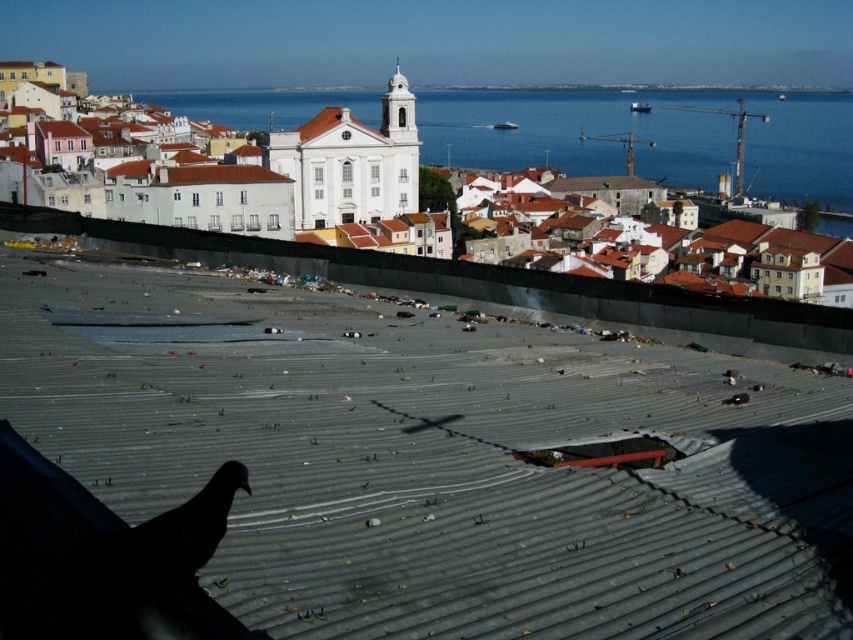
You are a photographer planning to capture the coastal town scene. You notice the black matte bird at lower left and the brown tile roof at center. Which object is closer to the camera in the composition?

The black matte bird at lower left is closer to the camera than the brown tile roof at center because it appears smaller in the image, suggesting it is farther away. However, according to the description, the bird is shorter in real life, so the brown tile roof at center is actually closer.

You are a photographer trying to capture the entire scene of the coastal town. You notice the black matte bird at lower left and the brown tile roof at center. Which object would appear larger in your photo?

The brown tile roof at center would appear larger in the photo because it is larger than the black matte bird at lower left.

You are a photographer trying to capture the blue water at center and the black matte bird at lower left in a single shot. Based on their positions, which object would appear closer to the camera in the final photo?

The black matte bird at lower left appears closer to the camera because it is positioned lower in the image compared to the blue water at center, which is taller and thus farther away.